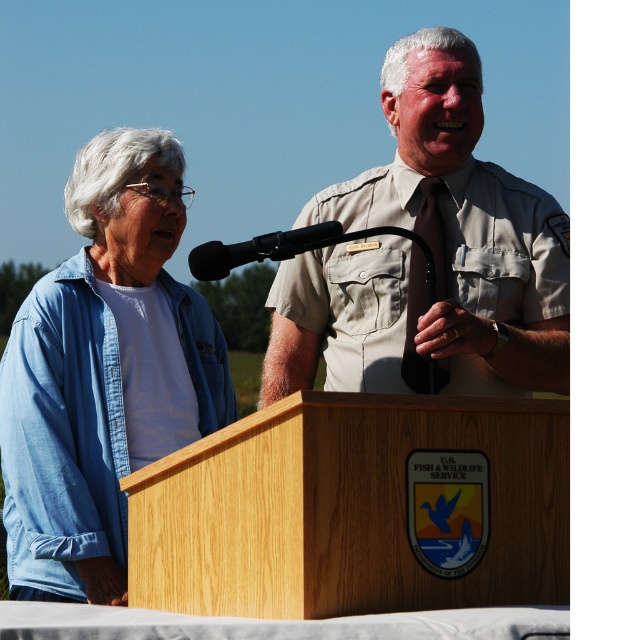
Question: Estimate the real-world distances between objects in this image. Which object is farther from the denim shirt at left?

Choices:
 (A) wooden podium at center
 (B) black matte microphone at center

Answer: (A)

Question: Does khaki uniform at center lie behind denim shirt at left?

Choices:
 (A) yes
 (B) no

Answer: (B)

Question: Which of these objects is positioned farthest from the denim shirt at left?

Choices:
 (A) wooden podium at center
 (B) black matte microphone at center
 (C) khaki uniform at center

Answer: (A)

Question: Is khaki uniform at center positioned behind black matte microphone at center?

Choices:
 (A) no
 (B) yes

Answer: (B)

Question: Can you confirm if khaki uniform at center is positioned below black matte microphone at center?

Choices:
 (A) yes
 (B) no

Answer: (A)

Question: Estimate the real-world distances between objects in this image. Which object is farther from the denim shirt at left?

Choices:
 (A) black matte microphone at center
 (B) khaki uniform at center
 (C) wooden podium at center

Answer: (C)